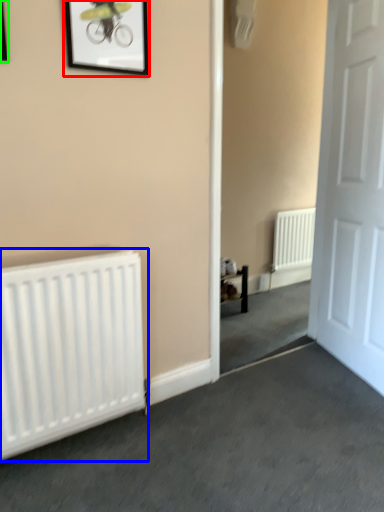
Question: Which object is positioned farthest from picture frame (highlighted by a red box)? Select from radiator (highlighted by a blue box) and picture frame (highlighted by a green box).

Choices:
 (A) radiator
 (B) picture frame

Answer: (A)